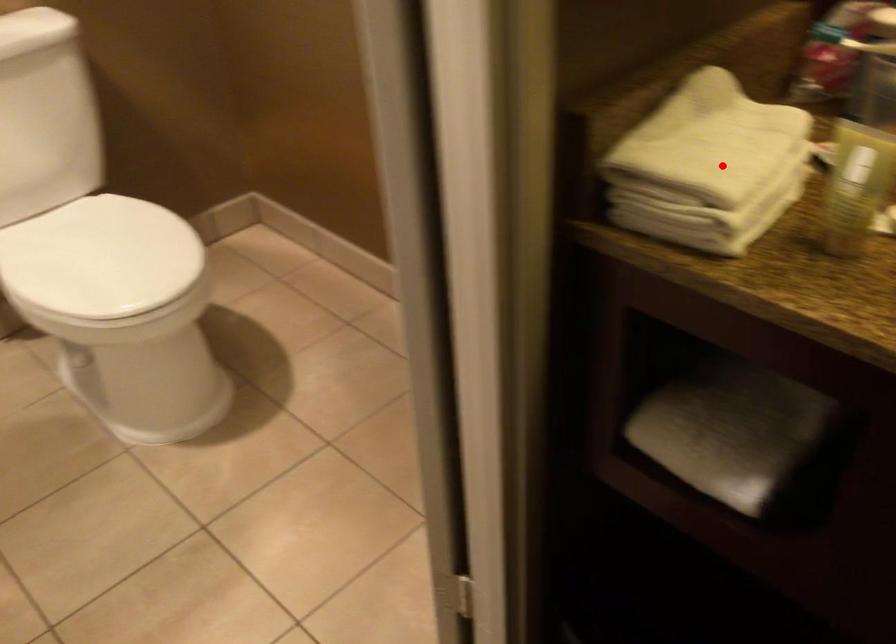
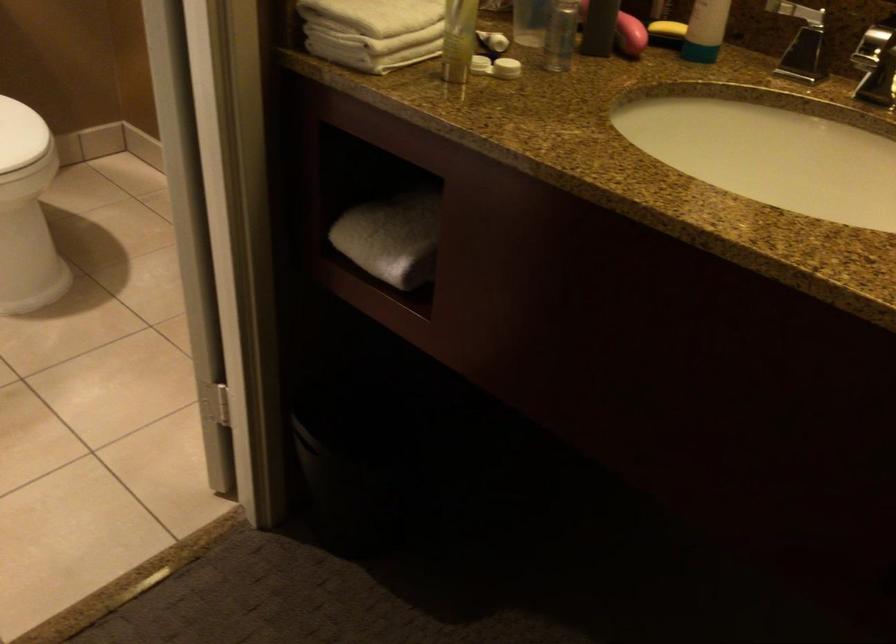
Find the pixel in the second image that matches the highlighted location in the first image.

(380, 14)